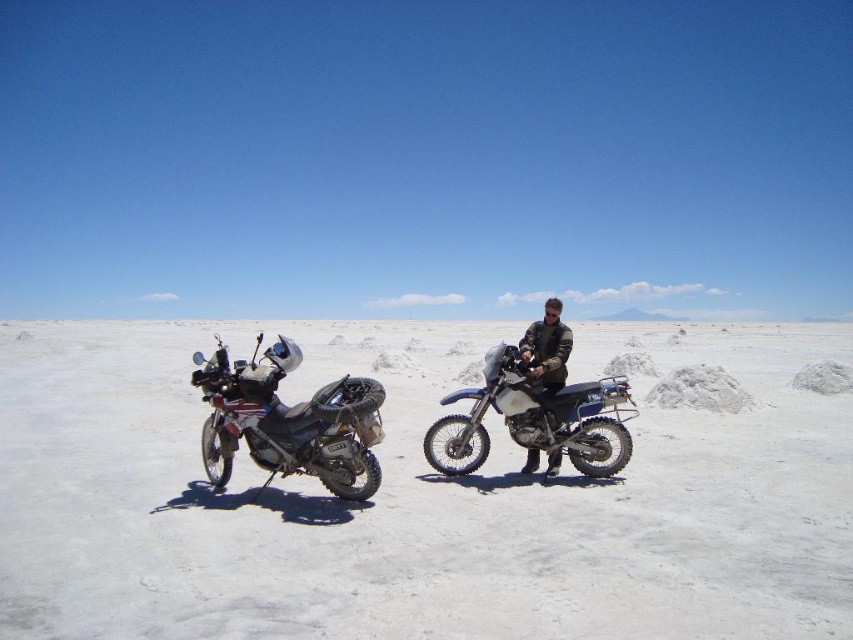
You are a photographer planning to take a wide shot of the salt flat landscape. You want to ensure both the white matte dirt bike at center and the matte black motorcycle at center are fully visible in the frame. Based on their positions, which bike should you focus on first to capture both in the shot?

The white matte dirt bike at center is above the matte black motorcycle at center, so focusing on the white matte dirt bike at center first will ensure both bikes are captured in the frame since it is positioned higher up.

You are navigating a salt flat and need to locate the matte black motorcycle at center. According to the coordinates provided, where would you find it?

The matte black motorcycle at center is located at coordinates point (534, 419).

You are planning to ride both the white matte dirt bike at center and the matte black motorcycle at left across the salt flats. Considering their heights, which one might be more suitable for navigating the small mounds of salt scattered across the landscape?

The matte black motorcycle at left is taller than the white matte dirt bike at center, making it better suited for navigating the small mounds of salt scattered across the landscape.